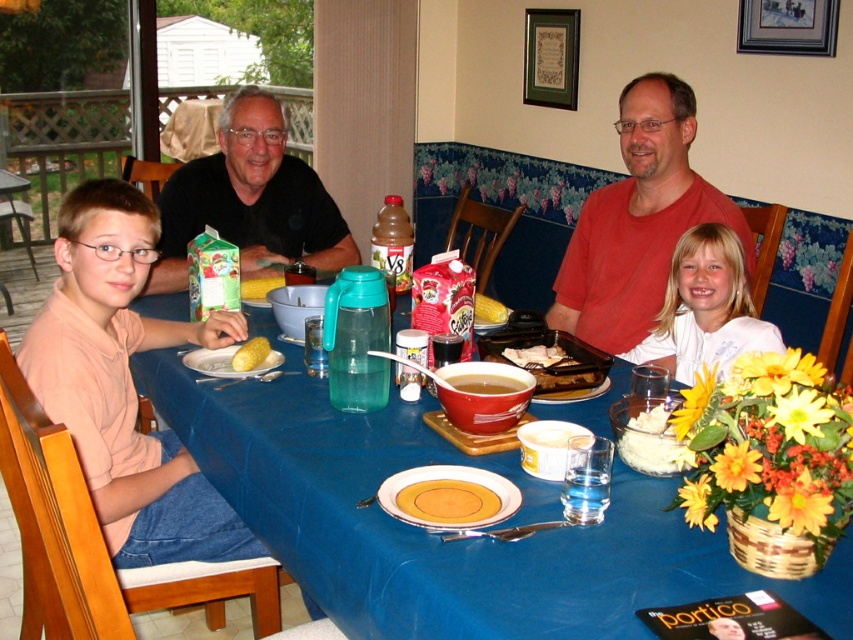
How distant is brown crispy chicken at center from yellow matte corn at table center?

A distance of 22.77 inches exists between brown crispy chicken at center and yellow matte corn at table center.

Does brown crispy chicken at center appear on the right side of yellow matte corn at table center?

Correct, you'll find brown crispy chicken at center to the right of yellow matte corn at table center.

Describe the element at coordinates (535, 355) in the screenshot. I see `brown crispy chicken at center` at that location.

Find the location of a particular element. brown crispy chicken at center is located at coordinates (535, 355).

Between point (186, 266) and point (480, 374), which one is positioned in front?

Point (480, 374) is more forward.

Can you confirm if black matte shirt at upper left is taller than brown matte bowl at center?

Yes, black matte shirt at upper left is taller than brown matte bowl at center.

Is point (251, 90) closer to viewer compared to point (466, 378)?

That is False.

Where is `black matte shirt at upper left`? black matte shirt at upper left is located at coordinates (248, 198).

Locate an element on the screen. Image resolution: width=853 pixels, height=640 pixels. blue fabric table at center is located at coordinates (433, 536).

Does point (468, 596) lie behind point (654, 99)?

No, it is in front of (654, 99).

This screenshot has width=853, height=640. Find the location of `blue fabric table at center`. blue fabric table at center is located at coordinates (433, 536).